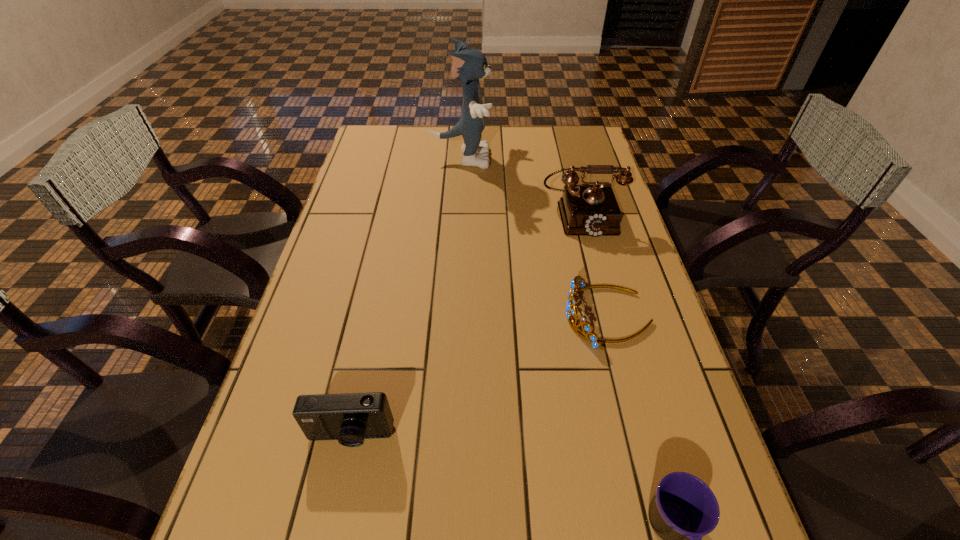
I want to click on free space located 0.240m on the front-facing side of the tiara, so click(469, 316).

Where is `vacant area situated on the front-facing side of the camera`? This screenshot has height=540, width=960. vacant area situated on the front-facing side of the camera is located at coordinates (329, 535).

This screenshot has height=540, width=960. Identify the location of object located in the far edge section of the desktop. (470, 65).

The image size is (960, 540). I want to click on object situated at the left edge, so click(x=350, y=418).

In order to click on telephone that is at the right edge in this screenshot , I will do `click(586, 210)`.

Identify the location of tiara located at the right edge. The width and height of the screenshot is (960, 540). (571, 309).

In order to click on vacant space at the far edge of the desktop in this screenshot , I will do `click(455, 141)`.

In the image, there is a desktop. Identify the location of vacant space at the left edge. (393, 160).

In the image, there is a desktop. At what (x,y) coordinates should I click in order to perform the action: click on vacant area at the right edge. Please return your answer as a coordinate pair (x, y). This screenshot has height=540, width=960. Looking at the image, I should click on (639, 300).

The image size is (960, 540). What are the coordinates of `free space between the tiara and the tallest object` in the screenshot? It's located at [x=534, y=237].